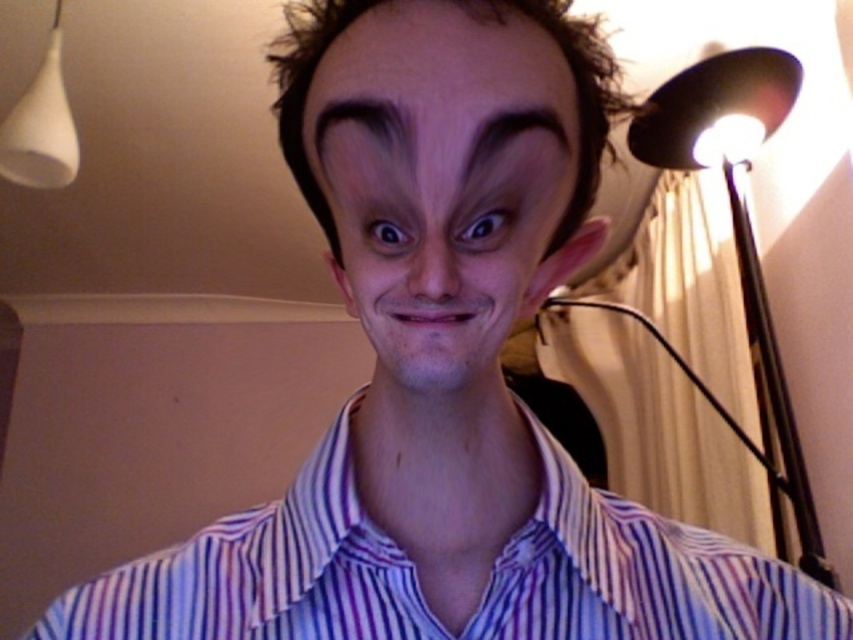
Is smooth skin face at center positioned before dark brown furrowed eyebrow at upper center?

Yes, smooth skin face at center is closer to the viewer.

Who is positioned more to the right, smooth skin face at center or dark brown furrowed eyebrow at upper center?

Positioned to the right is dark brown furrowed eyebrow at upper center.

Which is behind, point (505, 241) or point (517, 129)?

Point (505, 241)

Locate an element on the screen. smooth skin face at center is located at coordinates (444, 180).

Is point (606, 502) positioned before point (380, 248)?

No.

Which is behind, point (593, 493) or point (364, 227)?

The point (593, 493) is more distant.

The height and width of the screenshot is (640, 853). I want to click on purple striped shirt at center, so click(x=419, y=582).

Is dark purple hair at center thinner than black matte eye at center?

In fact, dark purple hair at center might be wider than black matte eye at center.

Describe the element at coordinates (434, 83) in the screenshot. I see `dark purple hair at center` at that location.

Is point (396, 120) behind point (380, 220)?

No, it is not.

The height and width of the screenshot is (640, 853). I want to click on dark purple hair at center, so click(x=434, y=83).